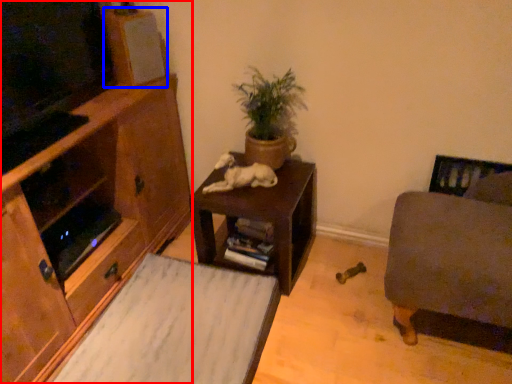
Question: Which of the following is the farthest to the observer, cabinetry (highlighted by a red box) or speaker (highlighted by a blue box)?

Choices:
 (A) cabinetry
 (B) speaker

Answer: (B)